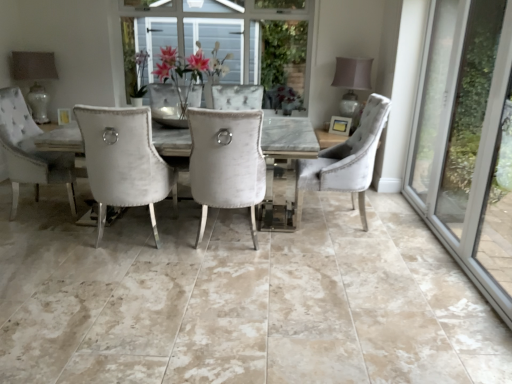
The width and height of the screenshot is (512, 384). What do you see at coordinates (33, 65) in the screenshot?
I see `matte glass lampshade at upper left, arranged as the 1th lamp when viewed from the left` at bounding box center [33, 65].

What do you see at coordinates (352, 82) in the screenshot?
I see `matte gray lampshade at upper right, the first lamp from the right` at bounding box center [352, 82].

Image resolution: width=512 pixels, height=384 pixels. In order to click on matte white vase at upper center in this screenshot , I will do `click(139, 74)`.

Is matte gray lampshade at upper right, the first lamp from the right, turned away from transparent glass door at right?

matte gray lampshade at upper right, the first lamp from the right, is not turned away from transparent glass door at right.

Based on the photo, which is farther from the camera, (345, 93) or (462, 198)?

The point (345, 93) is behind.

From a real-world perspective, which is physically above, matte gray lampshade at upper right, the first lamp from the right, or transparent glass door at right?

transparent glass door at right is physically above.

From the image's perspective, relative to transparent glass door at right, is matte gray lampshade at upper right, arranged as the 2th lamp when viewed from the left, above or below?

Clearly, from the image's perspective, matte gray lampshade at upper right, arranged as the 2th lamp when viewed from the left, is above transparent glass door at right.

Considering the sizes of objects matte gray lampshade at upper right, arranged as the 2th lamp when viewed from the left, and velvet white chair at center, marked as the 2th chair in a right-to-left arrangement, in the image provided, who is smaller, matte gray lampshade at upper right, arranged as the 2th lamp when viewed from the left, or velvet white chair at center, marked as the 2th chair in a right-to-left arrangement,?

Smaller between the two is matte gray lampshade at upper right, arranged as the 2th lamp when viewed from the left.

Does matte gray lampshade at upper right, arranged as the 2th lamp when viewed from the left, have a lesser height compared to velvet white chair at center, marked as the 2th chair in a right-to-left arrangement?

Correct, matte gray lampshade at upper right, arranged as the 2th lamp when viewed from the left, is not as tall as velvet white chair at center, marked as the 2th chair in a right-to-left arrangement.

Consider the image. Is matte gray lampshade at upper right, the first lamp from the right, further to the viewer compared to velvet white chair at center, marked as the 2th chair in a right-to-left arrangement?

Yes, matte gray lampshade at upper right, the first lamp from the right, is further from the camera.

From a real-world perspective, which object rests below the other?

velvet white chair at center, which ranks as the first chair in left-to-right order.

Could you tell me if transparent glass door at right is facing velvet white chair at center, marked as the 2th chair in a right-to-left arrangement?

Yes.

From the transparent glass door at right, count 1st chairs backward and point to it. Please provide its 2D coordinates.

[(226, 162)]

From the image's perspective, is transparent glass door at right above velvet grey chair at right, the second chair in the left-to-right sequence?

Yes.

Is transparent glass door at right in front of velvet grey chair at right, which ranks as the first chair in right-to-left order?

Yes, transparent glass door at right is closer to the viewer.

Measure the distance from transparent glass door at right to velvet grey chair at right, which ranks as the first chair in right-to-left order.

transparent glass door at right and velvet grey chair at right, which ranks as the first chair in right-to-left order, are 75.75 centimeters apart from each other.

Would you say transparent glass door at right is outside velvet grey chair at right, which ranks as the first chair in right-to-left order?

That's correct, transparent glass door at right is outside of velvet grey chair at right, which ranks as the first chair in right-to-left order.

Considering the relative sizes of velvet grey chair at right, which ranks as the first chair in right-to-left order, and velvet white chair at center, marked as the 2th chair in a right-to-left arrangement, in the image provided, is velvet grey chair at right, which ranks as the first chair in right-to-left order, wider than velvet white chair at center, marked as the 2th chair in a right-to-left arrangement,?

Correct, the width of velvet grey chair at right, which ranks as the first chair in right-to-left order, exceeds that of velvet white chair at center, marked as the 2th chair in a right-to-left arrangement.

Is velvet grey chair at right, the second chair in the left-to-right sequence, outside of velvet white chair at center, which ranks as the first chair in left-to-right order?

That's correct, velvet grey chair at right, the second chair in the left-to-right sequence, is outside of velvet white chair at center, which ranks as the first chair in left-to-right order.

Find the location of a particular element. The width and height of the screenshot is (512, 384). chair that appears on the left of velvet grey chair at right, which ranks as the first chair in right-to-left order is located at coordinates (226, 162).

From the image's perspective, would you say velvet grey chair at right, the second chair in the left-to-right sequence, is positioned over velvet white chair at center, marked as the 2th chair in a right-to-left arrangement?

Yes, from the image's perspective, velvet grey chair at right, the second chair in the left-to-right sequence, is above velvet white chair at center, marked as the 2th chair in a right-to-left arrangement.

Is transparent glass door at right positioned far away from matte white vase at upper center?

transparent glass door at right is positioned a significant distance from matte white vase at upper center.

From the image's perspective, is transparent glass door at right on top of matte white vase at upper center?

No.

Which of these two, transparent glass door at right or matte white vase at upper center, is wider?

Wider between the two is matte white vase at upper center.

Is transparent glass door at right facing away from matte white vase at upper center?

No, transparent glass door at right is not facing away from matte white vase at upper center.

Would you say transparent glass door at right is part of matte white vase at upper center's contents?

Definitely not — transparent glass door at right is not inside matte white vase at upper center.

Considering the points (142, 53) and (426, 115), which point is in front, point (142, 53) or point (426, 115)?

Positioned in front is point (142, 53).

Does matte white vase at upper center have a greater width compared to transparent glass door at right?

Yes.

Which of these two, matte white vase at upper center or transparent glass door at right, is bigger?

transparent glass door at right.

The image size is (512, 384). I want to click on window on the right of matte gray lampshade at upper right, arranged as the 2th lamp when viewed from the left, so click(466, 138).

Identify the location of the 2nd chair in front of the matte gray lampshade at upper right, the first lamp from the right, starting your count from the anchor. The width and height of the screenshot is (512, 384). (226, 162).

Considering their positions, is matte glass lampshade at upper left, arranged as the 1th lamp when viewed from the left, positioned further to transparent glass door at right than velvet grey chair at right, which ranks as the first chair in right-to-left order?

matte glass lampshade at upper left, arranged as the 1th lamp when viewed from the left, is positioned further to the anchor transparent glass door at right.

Which object lies nearer to the anchor point transparent glass door at right, matte gray lampshade at upper right, arranged as the 2th lamp when viewed from the left, or velvet grey chair at right, which ranks as the first chair in right-to-left order?

Among the two, velvet grey chair at right, which ranks as the first chair in right-to-left order, is located nearer to transparent glass door at right.

When comparing their distances from velvet white chair at center, which ranks as the first chair in left-to-right order, does velvet grey chair at right, the second chair in the left-to-right sequence, or matte gray lampshade at upper right, the first lamp from the right, seem further?

matte gray lampshade at upper right, the first lamp from the right, lies further to velvet white chair at center, which ranks as the first chair in left-to-right order, than the other object.

From the image, which object appears to be nearer to matte white vase at upper center, velvet white chair at center, marked as the 2th chair in a right-to-left arrangement, or velvet grey chair at right, the second chair in the left-to-right sequence?

velvet white chair at center, marked as the 2th chair in a right-to-left arrangement, is positioned closer to the anchor matte white vase at upper center.

Considering their positions, is matte white vase at upper center positioned closer to matte gray lampshade at upper right, arranged as the 2th lamp when viewed from the left, than matte glass lampshade at upper left, which is the second lamp in right-to-left order?

matte white vase at upper center.

Looking at the image, which one is located closer to transparent glass door at right, matte glass lampshade at upper left, which is the second lamp in right-to-left order, or velvet white chair at center, which ranks as the first chair in left-to-right order?

velvet white chair at center, which ranks as the first chair in left-to-right order, is closer to transparent glass door at right.

Looking at the image, which one is located closer to velvet grey chair at right, the second chair in the left-to-right sequence, matte gray lampshade at upper right, arranged as the 2th lamp when viewed from the left, or velvet white chair at center, marked as the 2th chair in a right-to-left arrangement?

Among the two, velvet white chair at center, marked as the 2th chair in a right-to-left arrangement, is located nearer to velvet grey chair at right, the second chair in the left-to-right sequence.

Considering their positions, is velvet white chair at center, marked as the 2th chair in a right-to-left arrangement, positioned further to matte gray lampshade at upper right, arranged as the 2th lamp when viewed from the left, than velvet grey chair at right, which ranks as the first chair in right-to-left order?

velvet white chair at center, marked as the 2th chair in a right-to-left arrangement, lies further to matte gray lampshade at upper right, arranged as the 2th lamp when viewed from the left, than the other object.

Where is `chair between velvet white chair at center, marked as the 2th chair in a right-to-left arrangement, and matte white vase at upper center from front to back`? This screenshot has width=512, height=384. chair between velvet white chair at center, marked as the 2th chair in a right-to-left arrangement, and matte white vase at upper center from front to back is located at coordinates (346, 161).

Locate an element on the screen. chair situated between matte glass lampshade at upper left, arranged as the 1th lamp when viewed from the left, and velvet grey chair at right, which ranks as the first chair in right-to-left order, from left to right is located at coordinates (226, 162).

Identify the location of chair between velvet white chair at center, which ranks as the first chair in left-to-right order, and transparent glass door at right from left to right. The width and height of the screenshot is (512, 384). (346, 161).

What are the coordinates of `plant between matte glass lampshade at upper left, which is the second lamp in right-to-left order, and velvet white chair at center, marked as the 2th chair in a right-to-left arrangement, from left to right` in the screenshot? It's located at (139, 74).